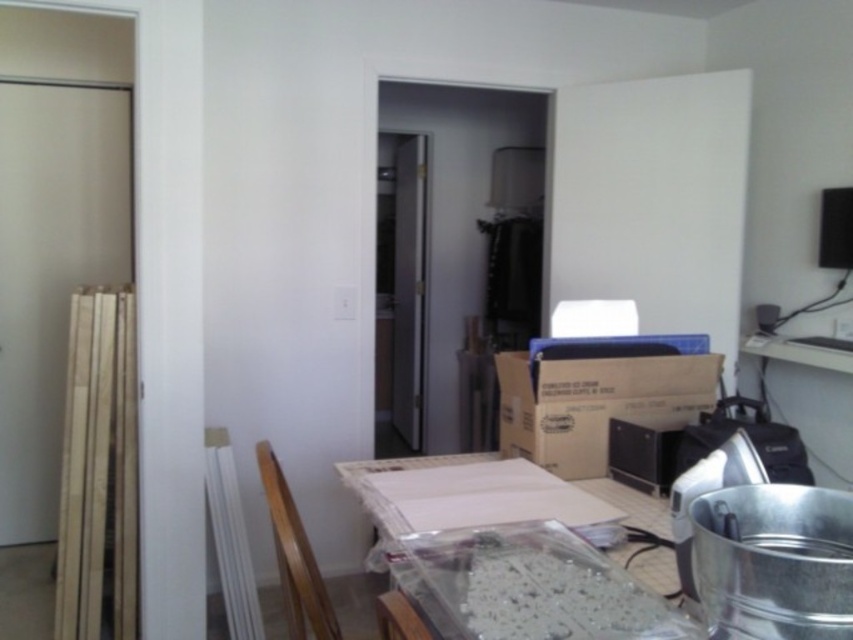
Question: Which of these objects is positioned closest to the clear plastic table at center?

Choices:
 (A) brown cardboard box at center
 (B) wooden chair at lower center

Answer: (B)

Question: In this image, where is clear plastic table at center located relative to brown cardboard box at center?

Choices:
 (A) right
 (B) left

Answer: (B)

Question: Which point is farther from the camera taking this photo?

Choices:
 (A) (299, 522)
 (B) (418, 584)

Answer: (A)

Question: Which of the following is the farthest from the observer?

Choices:
 (A) wooden chair at lower center
 (B) brown cardboard box at center

Answer: (B)

Question: Is clear plastic table at center smaller than brown cardboard box at center?

Choices:
 (A) yes
 (B) no

Answer: (B)

Question: Where is brown cardboard box at center located in relation to wooden chair at lower center in the image?

Choices:
 (A) below
 (B) above

Answer: (B)